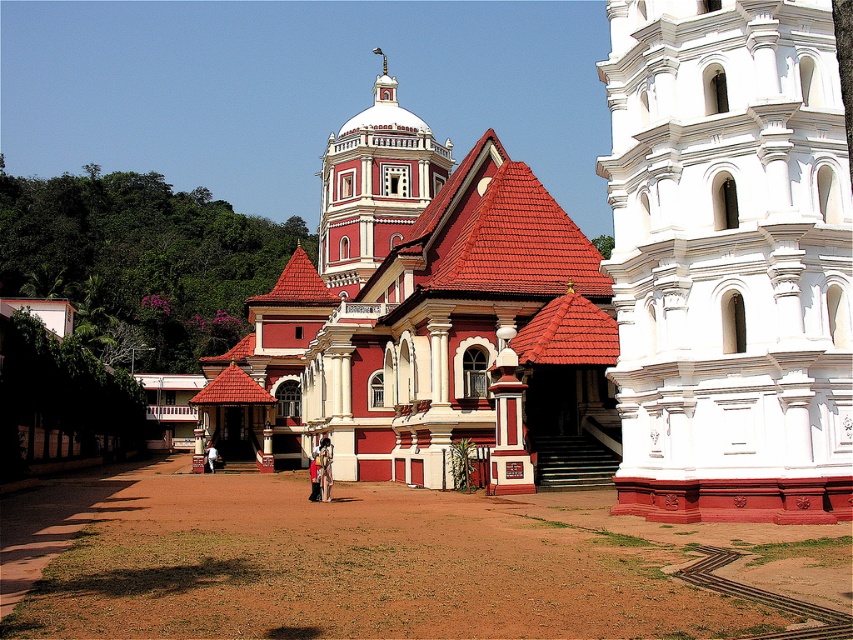
You are planning to place a decorative banner on the red matte church at center. The banner you have is the same size as the dark blue fabric at center. Will the banner fit the width of the church?

The red matte church at center is wider than the dark blue fabric at center, so the banner, which is the same size as the dark blue fabric at center, will fit within the church width.

You are a tourist standing in front of the white stone tower at right and the red matte church at center. Which structure is closer to you?

The white stone tower at right is closer to you since it is in front of the red matte church at center.